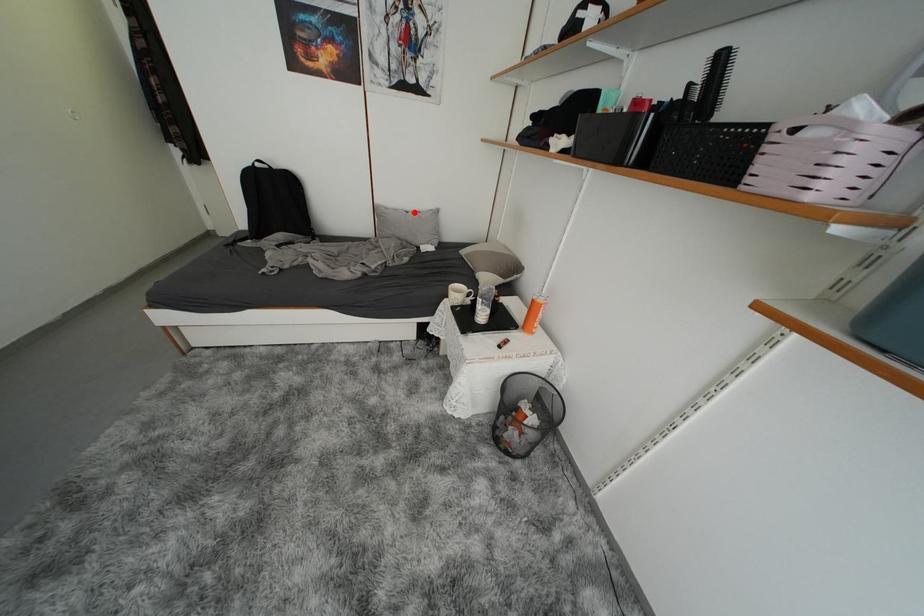
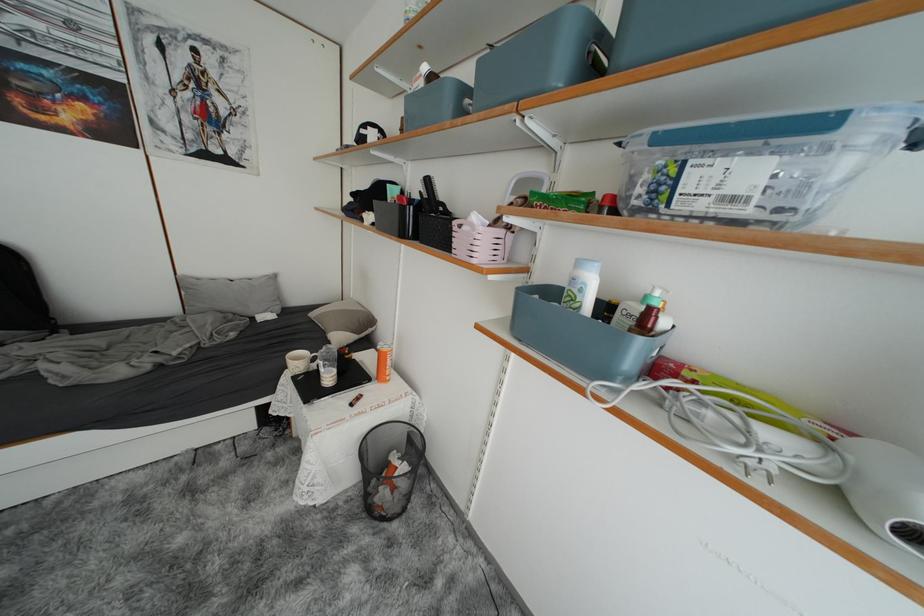
Question: I am providing you with two images of the same scene from different viewpoints. Given a red point in image1, look at the same physical point in image2. Is it:

Choices:
 (A) Closer to the viewpoint
 (B) Farther from the viewpoint

Answer: (B)